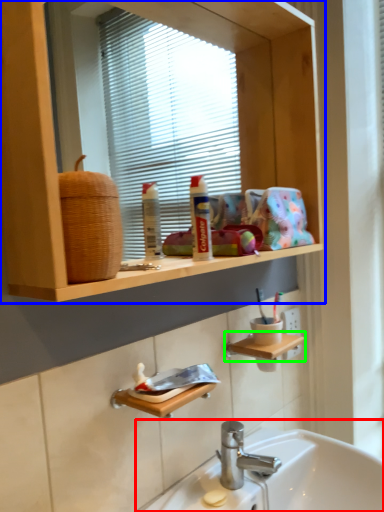
Question: Based on their relative distances, which object is nearer to sink (highlighted by a red box)? Choose from bathroom cabinet (highlighted by a blue box) and shelf (highlighted by a green box).

Choices:
 (A) bathroom cabinet
 (B) shelf

Answer: (B)